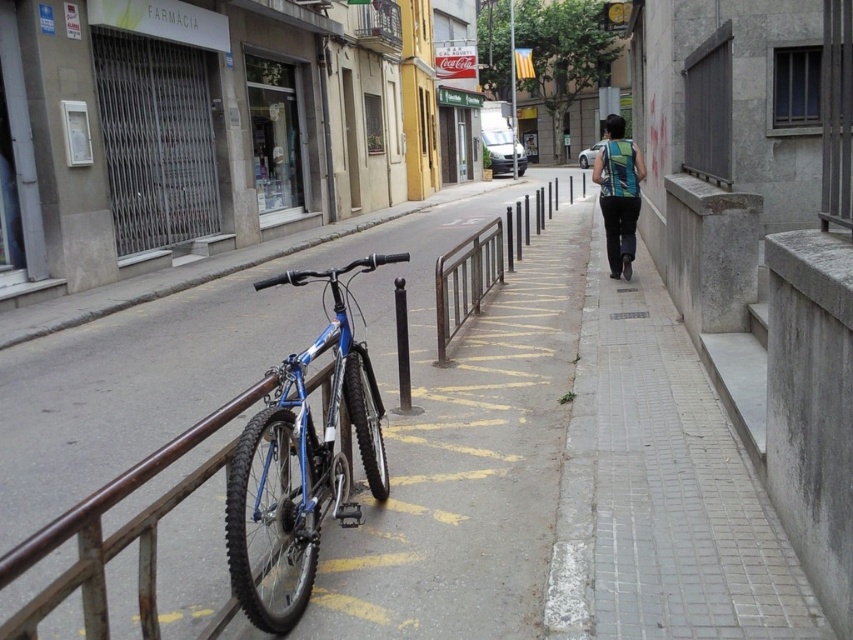
You are standing on the sidewalk in the urban street scene and want to determine the distance between two points marked in the image. The first point is at coordinates point (486, 600) and the second is at point (631, 257). Which point is closer to you?

Point (486, 600) is closer to the viewer than point (631, 257).

You are a delivery person who needs to move your blue metallic bicycle at left closer to the brown metal rail at center. The distance between them is 10.15 meters. If your bicycle can move 2 meters per minute, how many minutes will it take to reach the rail?

The blue metallic bicycle at left is 10.15 meters away from the brown metal rail at center. At a speed of 2 meters per minute, it would take 10.15 divided by 2, which equals approximately 5.075 minutes. Rounding to two decimal places, it would take about 5.08 minutes.

You are a delivery person who needs to place a package on the smooth concrete pavement at center. However, there is a green striped tank top at center in the way. Since you can only move the object with the smaller width, which object should you move to make space?

The smooth concrete pavement at center has a lesser width compared to green striped tank top at center, so you should move the smooth concrete pavement at center to make space.